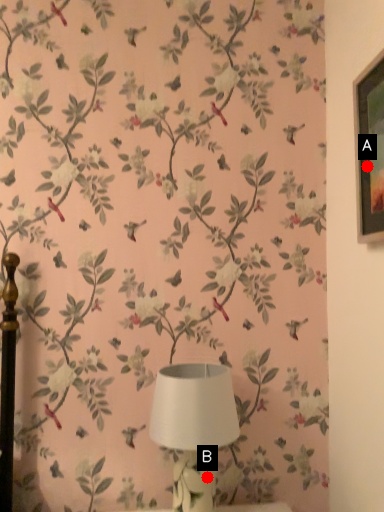
Question: Two points are circled on the image, labeled by A and B beside each circle. Which of the following is the farthest from the observer?

Choices:
 (A) A is further
 (B) B is further

Answer: (B)